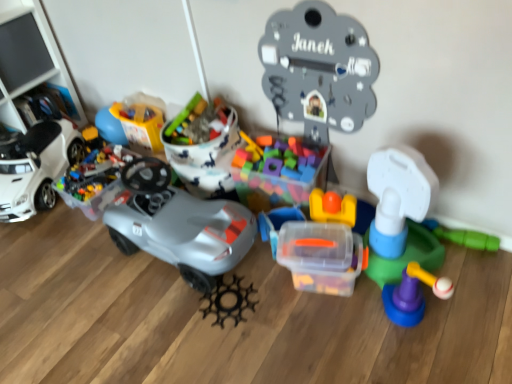
Question: Should I look upward or downward to see white matte toy car at left?

Choices:
 (A) up
 (B) down

Answer: (A)

Question: From a real-world perspective, is black plastic gear at center, which is the fifth toy from right to left, over white matte toy car at left?

Choices:
 (A) no
 (B) yes

Answer: (A)

Question: From a real-world perspective, is black plastic gear at center, placed as the 4th toy when sorted from left to right, physically below white matte toy car at left?

Choices:
 (A) no
 (B) yes

Answer: (B)

Question: Is white matte toy car at left located within black plastic gear at center, which is the fifth toy from right to left?

Choices:
 (A) yes
 (B) no

Answer: (B)

Question: Is black plastic gear at center, placed as the 4th toy when sorted from left to right, positioned in front of white matte toy car at left?

Choices:
 (A) no
 (B) yes

Answer: (B)

Question: Is black plastic gear at center, which is the fifth toy from right to left, positioned with its back to white matte toy car at left?

Choices:
 (A) no
 (B) yes

Answer: (A)

Question: Is black plastic gear at center, placed as the 4th toy when sorted from left to right, placed right next to white matte toy car at left?

Choices:
 (A) no
 (B) yes

Answer: (A)

Question: Can you confirm if transparent plastic container at center, the seventh toy when ordered from left to right, is positioned to the right of matte gray car at center, acting as the sixth toy starting from the right?

Choices:
 (A) yes
 (B) no

Answer: (A)

Question: Does transparent plastic container at center, the seventh toy when ordered from left to right, have a lesser height compared to matte gray car at center, arranged as the 3th toy when viewed from the left?

Choices:
 (A) yes
 (B) no

Answer: (A)

Question: From the image's perspective, is transparent plastic container at center, the seventh toy when ordered from left to right, over matte gray car at center, acting as the sixth toy starting from the right?

Choices:
 (A) no
 (B) yes

Answer: (A)

Question: From a real-world perspective, is transparent plastic container at center, the seventh toy when ordered from left to right, positioned over matte gray car at center, arranged as the 3th toy when viewed from the left, based on gravity?

Choices:
 (A) yes
 (B) no

Answer: (B)

Question: Is transparent plastic container at center, the seventh toy when ordered from left to right, far from matte gray car at center, arranged as the 3th toy when viewed from the left?

Choices:
 (A) yes
 (B) no

Answer: (B)

Question: Is transparent plastic container at center, the seventh toy when ordered from left to right, taller than matte gray car at center, arranged as the 3th toy when viewed from the left?

Choices:
 (A) no
 (B) yes

Answer: (A)

Question: From the image's perspective, is translucent plastic container at center, which is counted as the 4th toy, starting from the right, beneath translucent plastic container at upper left, the seventh toy positioned from the right?

Choices:
 (A) yes
 (B) no

Answer: (A)